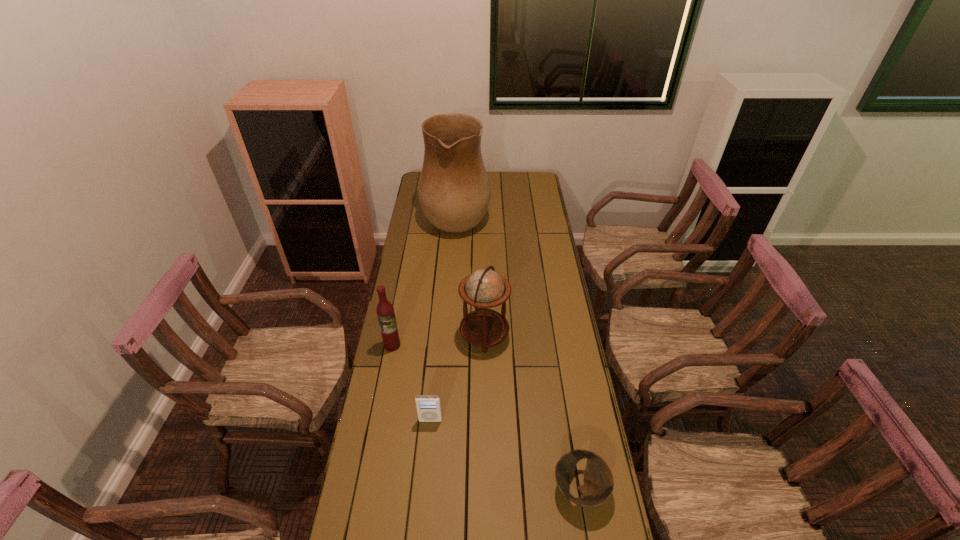
The width and height of the screenshot is (960, 540). What are the coordinates of `the farthest object` in the screenshot? It's located at (454, 192).

The width and height of the screenshot is (960, 540). What are the coordinates of `the tallest object` in the screenshot? It's located at (454, 192).

Find the location of a particular element. The image size is (960, 540). globe is located at coordinates (484, 288).

Find the location of a particular element. The width and height of the screenshot is (960, 540). the leftmost object is located at coordinates (385, 312).

Locate an element on the screen. This screenshot has height=540, width=960. iPod is located at coordinates (428, 407).

Locate an element on the screen. The image size is (960, 540). the fourth tallest object is located at coordinates (428, 407).

The height and width of the screenshot is (540, 960). I want to click on bowl, so click(x=598, y=485).

The width and height of the screenshot is (960, 540). Find the location of `the rightmost object`. the rightmost object is located at coordinates 598,485.

The height and width of the screenshot is (540, 960). I want to click on free space located at the spout of the tallest object, so click(x=533, y=215).

The width and height of the screenshot is (960, 540). Identify the location of vacant space situated on the surface of the globe. (410, 335).